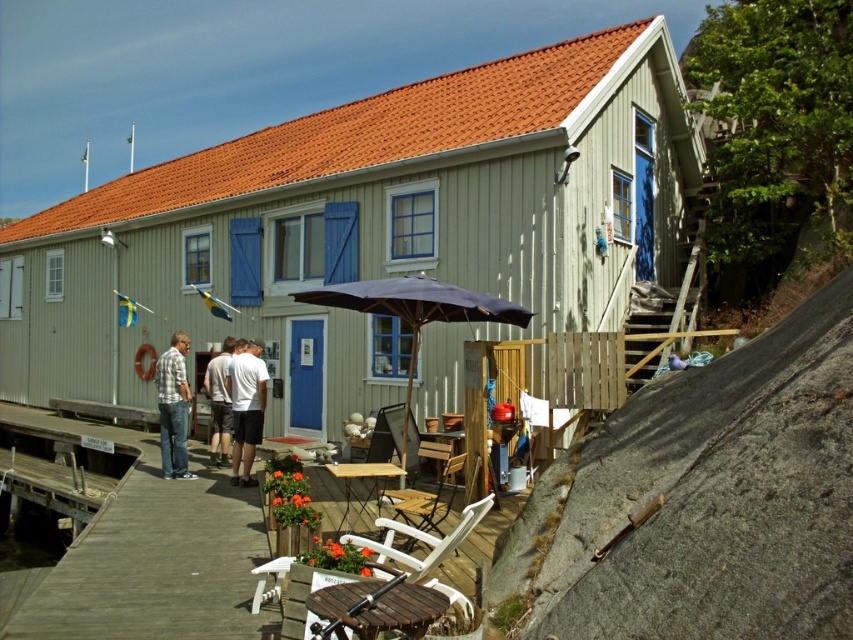
You are standing at the point marked by the coordinates point (149, 556). Looking towards the wooden building with the blue door, which direction should you walk to reach the building?

The white wood deck at lower left is represented by point (149, 556). Since the building is in front of the deck, you should walk forward towards the building.

You are standing on the white wood deck at lower left and want to reach the white cotton shirt at center. Which direction should you move to get closer to the shirt?

The white wood deck at lower left is positioned under the white cotton shirt at center, so you should move upward to get closer to the shirt.